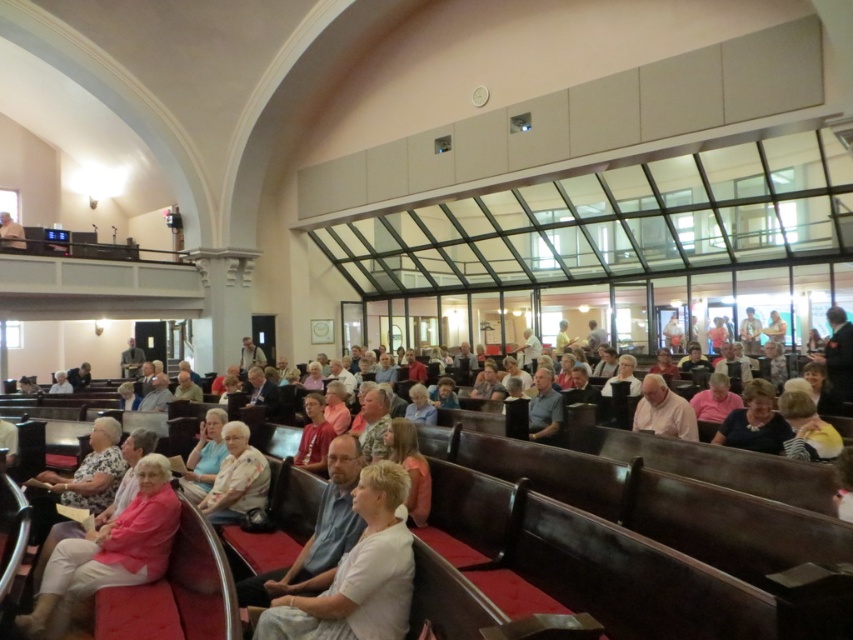
Can you confirm if matte gray shirt at center is thinner than light brown wooden pulpit at upper left?

Indeed, matte gray shirt at center has a lesser width compared to light brown wooden pulpit at upper left.

Which of these two, matte gray shirt at center or light brown wooden pulpit at upper left, stands shorter?

With less height is matte gray shirt at center.

Between point (544, 372) and point (7, 237), which one is positioned in front?

Point (544, 372) is in front.

I want to click on matte gray shirt at center, so click(x=544, y=406).

Which of these two, white cotton shirt at center or light beige shirt at center, stands shorter?

Standing shorter between the two is light beige shirt at center.

The height and width of the screenshot is (640, 853). I want to click on white cotton shirt at center, so click(x=358, y=573).

Does light beige shirt at center appear on the left side of light beige fabric chair at lower left?

In fact, light beige shirt at center is to the right of light beige fabric chair at lower left.

Between light beige shirt at center and light beige fabric chair at lower left, which one appears on the right side from the viewer's perspective?

Positioned to the right is light beige shirt at center.

Locate an element on the screen. The width and height of the screenshot is (853, 640). light beige shirt at center is located at coordinates (663, 410).

Identify the location of light beige shirt at center. (663, 410).